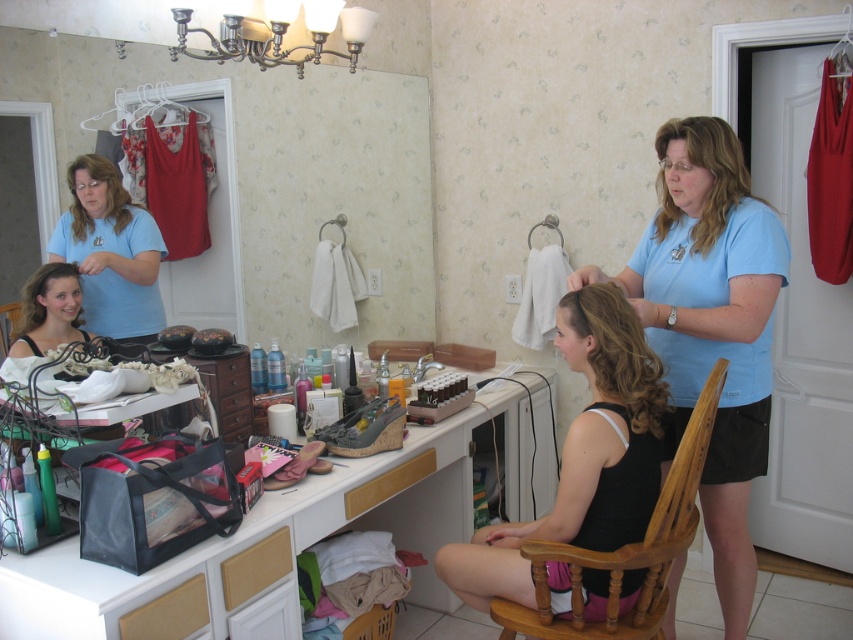
Is point (682, 380) positioned in front of point (77, 198)?

No.

Does point (763, 394) come behind point (113, 186)?

No.

Is point (689, 164) positioned after point (91, 225)?

No, (689, 164) is in front of (91, 225).

Find the location of `light blue t-shirt at upper right`. light blue t-shirt at upper right is located at coordinates point(711,324).

Between black matte hair at center and matte black hair at center, which one appears on the left side from the viewer's perspective?

matte black hair at center is more to the left.

Is black matte hair at center wider than matte black hair at center?

Correct, the width of black matte hair at center exceeds that of matte black hair at center.

Between point (560, 593) and point (67, 339), which one is positioned in front?

Positioned in front is point (560, 593).

Identify the location of black matte hair at center. The height and width of the screenshot is (640, 853). (582, 454).

Who is shorter, matte blue shirt at center or dark brown silky hair at center?

dark brown silky hair at center is shorter.

Can you confirm if matte blue shirt at center is bigger than dark brown silky hair at center?

Incorrect, matte blue shirt at center is not larger than dark brown silky hair at center.

Describe the element at coordinates (109, 252) in the screenshot. The height and width of the screenshot is (640, 853). I see `matte blue shirt at center` at that location.

Image resolution: width=853 pixels, height=640 pixels. Find the location of `matte blue shirt at center`. matte blue shirt at center is located at coordinates (109, 252).